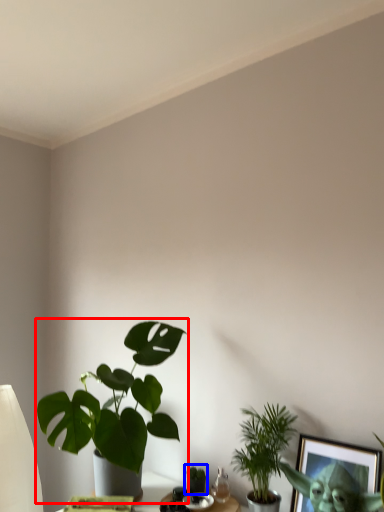
Question: Which of the following is the closest to the observer, houseplant (highlighted by a red box) or houseplant (highlighted by a blue box)?

Choices:
 (A) houseplant
 (B) houseplant

Answer: (A)